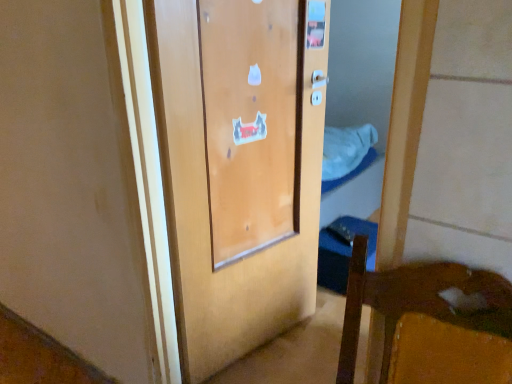
Question: Does white fabric at center appear on the left side of wooden door at center?

Choices:
 (A) yes
 (B) no

Answer: (B)

Question: Would you say white fabric at center is a long distance from wooden door at center?

Choices:
 (A) yes
 (B) no

Answer: (A)

Question: Does white fabric at center have a lesser height compared to wooden door at center?

Choices:
 (A) no
 (B) yes

Answer: (B)

Question: Is white fabric at center wider than wooden door at center?

Choices:
 (A) yes
 (B) no

Answer: (A)

Question: Can you confirm if white fabric at center is positioned to the right of wooden door at center?

Choices:
 (A) yes
 (B) no

Answer: (A)

Question: Is white fabric at center next to wooden door at center and touching it?

Choices:
 (A) yes
 (B) no

Answer: (B)

Question: From the image's perspective, is wooden door at center over white fabric at center?

Choices:
 (A) no
 (B) yes

Answer: (A)

Question: Considering the relative sizes of wooden door at center and white fabric at center in the image provided, is wooden door at center smaller than white fabric at center?

Choices:
 (A) no
 (B) yes

Answer: (A)

Question: From the image's perspective, is wooden door at center below white fabric at center?

Choices:
 (A) yes
 (B) no

Answer: (A)

Question: From a real-world perspective, is wooden door at center over white fabric at center?

Choices:
 (A) no
 (B) yes

Answer: (B)

Question: Considering the relative sizes of wooden door at center and white fabric at center in the image provided, is wooden door at center bigger than white fabric at center?

Choices:
 (A) no
 (B) yes

Answer: (B)

Question: Does wooden door at center have a greater height compared to white fabric at center?

Choices:
 (A) yes
 (B) no

Answer: (A)

Question: Is wooden door at center wider or thinner than white fabric at center?

Choices:
 (A) wide
 (B) thin

Answer: (B)